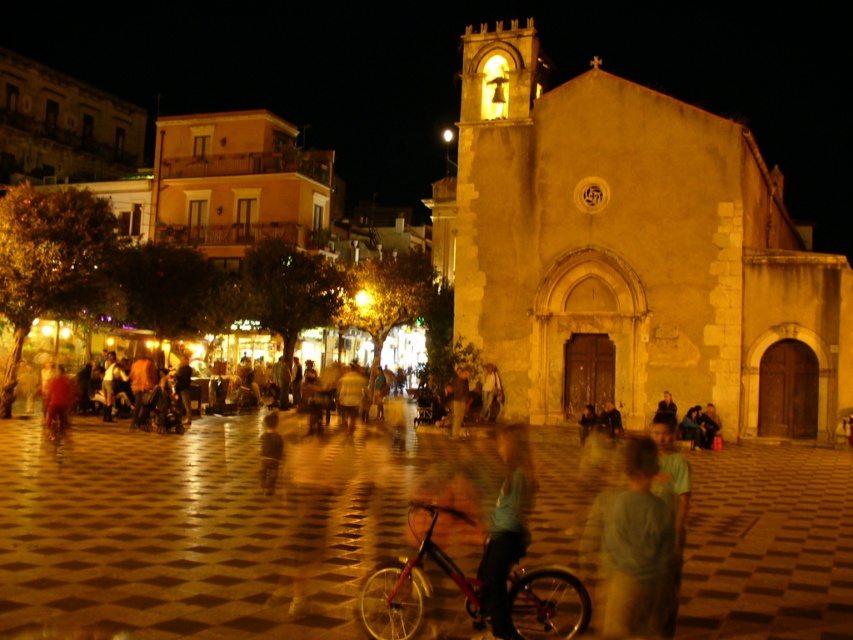
Between yellow stone church at center and light blue fabric shirt at center, which one has more height?

Standing taller between the two is yellow stone church at center.

Between yellow stone church at center and light blue fabric shirt at center, which one is positioned lower?

light blue fabric shirt at center is below.

Describe the element at coordinates (631, 253) in the screenshot. I see `yellow stone church at center` at that location.

This screenshot has height=640, width=853. Identify the location of yellow stone church at center. (631, 253).

Is light blue cotton shirt at center to the left of light brown fabric shirt at center from the viewer's perspective?

In fact, light blue cotton shirt at center is to the right of light brown fabric shirt at center.

Identify the location of light blue cotton shirt at center. The image size is (853, 640). (631, 548).

Which is behind, point (39, 557) or point (576, 248)?

Positioned behind is point (576, 248).

Does matte stone pavement at center have a larger size compared to yellow stone church at center?

Actually, matte stone pavement at center might be smaller than yellow stone church at center.

Image resolution: width=853 pixels, height=640 pixels. I want to click on matte stone pavement at center, so click(199, 525).